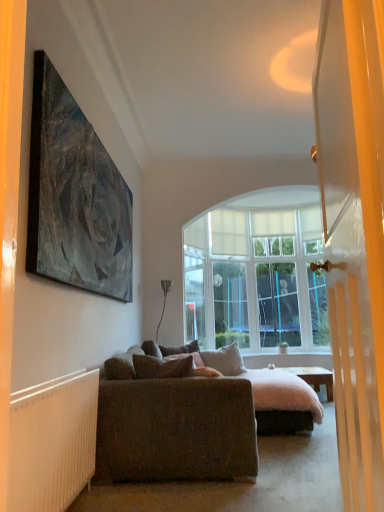
Question: Is wooden desk at center bigger or smaller than velvet purple pillow at center, marked as the 1th pillow in a back-to-front arrangement?

Choices:
 (A) small
 (B) big

Answer: (B)

Question: Considering their positions, is wooden desk at center located in front of or behind velvet purple pillow at center, marked as the 1th pillow in a back-to-front arrangement?

Choices:
 (A) behind
 (B) front

Answer: (A)

Question: Considering the real-world distances, which object is farthest from the green leafy plant at center?

Choices:
 (A) textured brown couch at center
 (B) white soft pillow at center, the 2th pillow positioned from the front
 (C) metallic silver floor lamp at center
 (D) brown fabric pillow at center, positioned as the third pillow in back-to-front order
 (E) wooden desk at center

Answer: (A)

Question: Which object is the closest to the green leafy plant at center?

Choices:
 (A) white sheer curtain at right
 (B) velvet purple pillow at center, marked as the 1th pillow in a back-to-front arrangement
 (C) wooden desk at center
 (D) metallic silver floor lamp at center
 (E) clear glass screen door at center

Answer: (E)